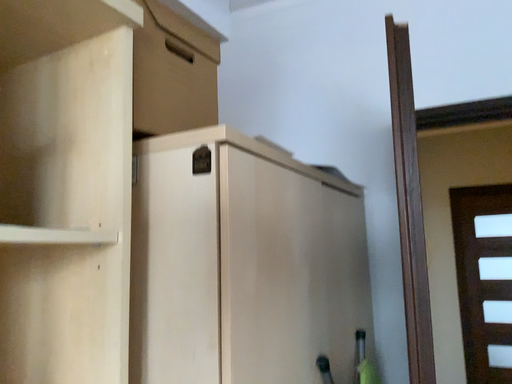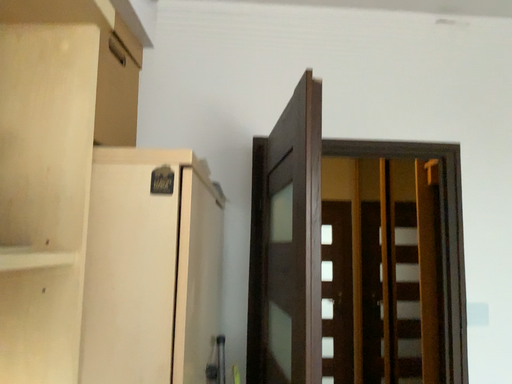
Question: Which way did the camera rotate in the video?

Choices:
 (A) rotated right
 (B) rotated left

Answer: (A)